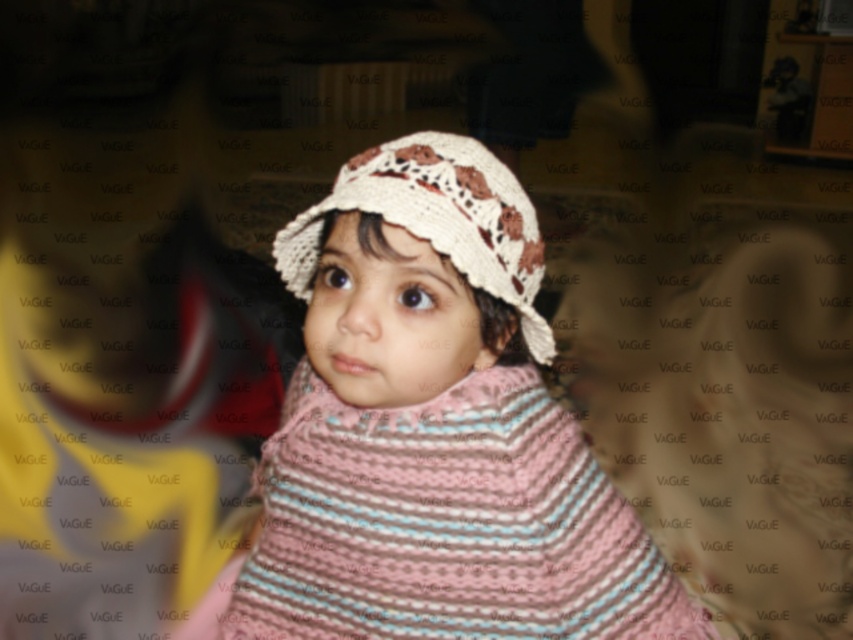
You are a photographer who wants to adjust the focus on the image. You need to focus on both the white knitted hat at center and the crochet beige hat at center. Which hat should you adjust the focus to first if you want to focus on the one that is lower in the image?

The white knitted hat at center is located below the crochet beige hat at center, so you should focus on the white knitted hat at center first since it is lower in the image.

You are a photographer who wants to capture a clear image of both the white knitted hat at center and the crochet beige hat at center. However, the current image has a blurred overlay with the word VAGUE. Which hat would appear more in focus if you adjust the camera focus to the foreground?

The white knitted hat at center would appear more in focus because it is closer to the viewer than the crochet beige hat at center, so adjusting the focus to the foreground would prioritize its clarity.